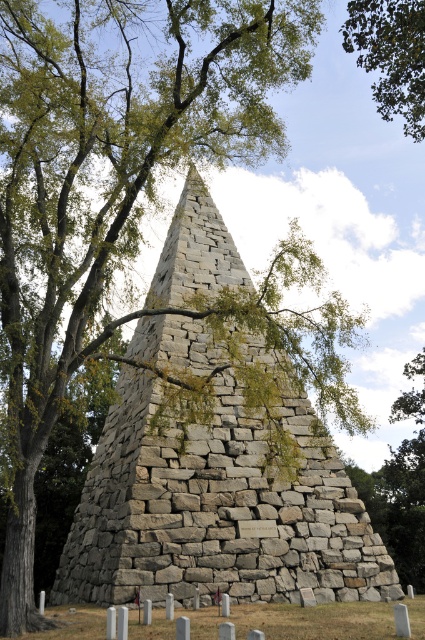
Question: Can you confirm if gray stone pyramid at center is positioned below green leafy tree at upper right?

Choices:
 (A) no
 (B) yes

Answer: (B)

Question: Is gray stone pyramid at center wider than green leafy tree at upper right?

Choices:
 (A) no
 (B) yes

Answer: (B)

Question: Which object appears closest to the camera in this image?

Choices:
 (A) gray stone pyramid at center
 (B) green leafy tree at upper right

Answer: (A)

Question: Which object appears farthest from the camera in this image?

Choices:
 (A) green leafy tree at upper right
 (B) gray stone pyramid at center

Answer: (A)

Question: Does gray stone pyramid at center appear on the left side of green leafy tree at upper right?

Choices:
 (A) no
 (B) yes

Answer: (B)